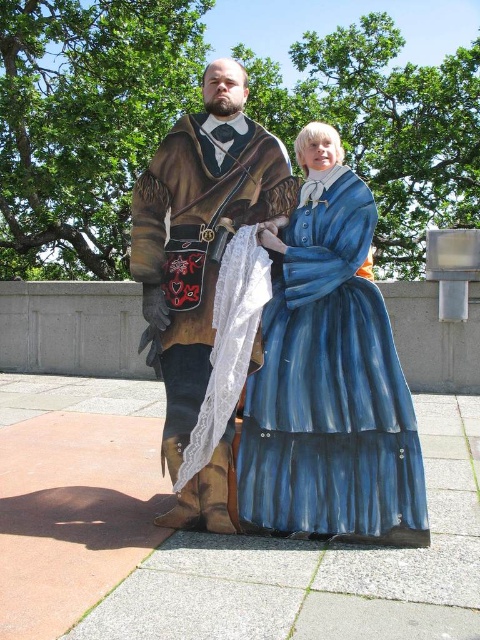
From the picture: You are a costume designer preparing for a historical play. You need to place the matte brown leather coat at center and the blue satin dress at center in a display case. The case has a glass panel that is 1.2 meters wide. Can both items fit side by side without overlapping?

The matte brown leather coat at center is to the left of the blue satin dress at center. However, the description does not provide their individual widths or total combined width, so it is impossible to determine if they can fit side by side in the 1.2 meter wide case without overlapping.

You are a costume designer preparing for a historical play. You have two items in front of you on a table. The matte brown leather coat at center and the brown leather robe at center. Which one would you choose if you need a larger piece of clothing for a character who requires more dramatic presence?

The matte brown leather coat at center is larger in size than the brown leather robe at center, so you should choose the matte brown leather coat at center for the character needing a larger, more dramatic presence.